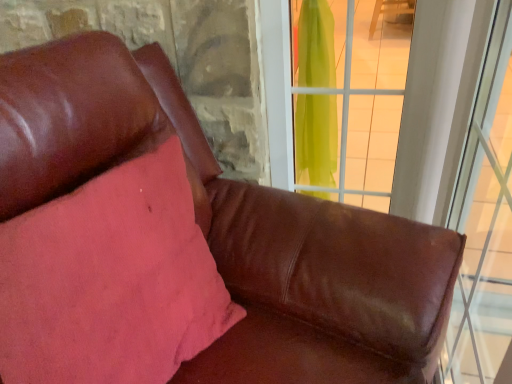
Question: Can you confirm if pink fabric pillow at upper left is bigger than transparent green curtain at upper right, marked as the 2th window in a right-to-left arrangement?

Choices:
 (A) yes
 (B) no

Answer: (A)

Question: Considering the relative sizes of pink fabric pillow at upper left and transparent green curtain at upper right, marked as the 2th window in a right-to-left arrangement, in the image provided, is pink fabric pillow at upper left shorter than transparent green curtain at upper right, marked as the 2th window in a right-to-left arrangement,?

Choices:
 (A) no
 (B) yes

Answer: (A)

Question: Is pink fabric pillow at upper left to the right of transparent green curtain at upper right, marked as the 2th window in a right-to-left arrangement, from the viewer's perspective?

Choices:
 (A) yes
 (B) no

Answer: (B)

Question: From a real-world perspective, is pink fabric pillow at upper left located higher than transparent green curtain at upper right, the first window in the left-to-right sequence?

Choices:
 (A) no
 (B) yes

Answer: (A)

Question: Considering the relative positions of pink fabric pillow at upper left and transparent green curtain at upper right, the first window in the left-to-right sequence, in the image provided, is pink fabric pillow at upper left behind transparent green curtain at upper right, the first window in the left-to-right sequence,?

Choices:
 (A) yes
 (B) no

Answer: (B)

Question: Choose the correct answer: Is transparent glass window at right, which ranks as the second window in left-to-right order, inside pink fabric pillow at upper left or outside it?

Choices:
 (A) outside
 (B) inside

Answer: (A)

Question: Based on their sizes in the image, would you say transparent glass window at right, which ranks as the second window in left-to-right order, is bigger or smaller than pink fabric pillow at upper left?

Choices:
 (A) big
 (B) small

Answer: (A)

Question: Is point (496, 246) positioned closer to the camera than point (17, 244)?

Choices:
 (A) closer
 (B) farther

Answer: (B)

Question: From a real-world perspective, is transparent glass window at right, the 1th window positioned from the right, above or below pink fabric pillow at upper left?

Choices:
 (A) below
 (B) above

Answer: (A)

Question: Considering the positions of pink fabric pillow at upper left and transparent green curtain at upper right, the first window in the left-to-right sequence, in the image, is pink fabric pillow at upper left taller or shorter than transparent green curtain at upper right, the first window in the left-to-right sequence,?

Choices:
 (A) tall
 (B) short

Answer: (A)

Question: Considering their positions, is pink fabric pillow at upper left located in front of or behind transparent green curtain at upper right, the first window in the left-to-right sequence?

Choices:
 (A) behind
 (B) front

Answer: (B)

Question: From the image's perspective, is pink fabric pillow at upper left above or below transparent green curtain at upper right, marked as the 2th window in a right-to-left arrangement?

Choices:
 (A) above
 (B) below

Answer: (B)

Question: Based on their sizes in the image, would you say pink fabric pillow at upper left is bigger or smaller than transparent green curtain at upper right, the first window in the left-to-right sequence?

Choices:
 (A) small
 (B) big

Answer: (B)

Question: From their relative heights in the image, would you say pink fabric pillow at upper left is taller or shorter than transparent glass window at right, which ranks as the second window in left-to-right order?

Choices:
 (A) short
 (B) tall

Answer: (A)

Question: From a real-world perspective, is pink fabric pillow at upper left above or below transparent glass window at right, the 1th window positioned from the right?

Choices:
 (A) above
 (B) below

Answer: (A)